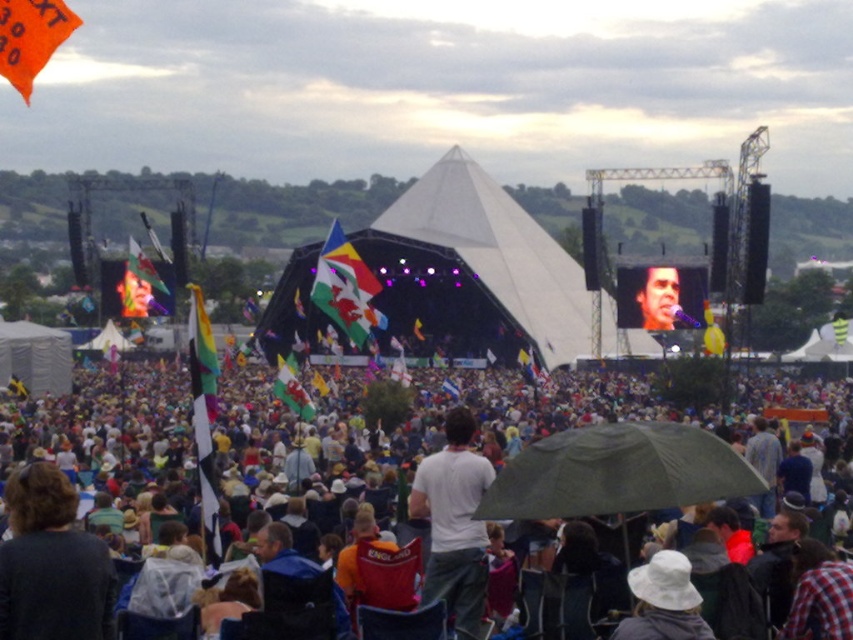
Who is more forward, (128, 378) or (646, 324)?

Point (646, 324) is more forward.

Between white fabric crowd at center and smooth skin face at center, which one has less height?

Standing shorter between the two is smooth skin face at center.

Which is in front, point (535, 522) or point (646, 273)?

Point (535, 522)

Identify the location of white fabric crowd at center. This screenshot has width=853, height=640. (108, 426).

Between dark gray sweater at lower left and white cotton shirt at center, which one appears on the left side from the viewer's perspective?

From the viewer's perspective, dark gray sweater at lower left appears more on the left side.

Between point (61, 621) and point (457, 592), which one is positioned in front?

Point (61, 621)

Locate an element on the screen. dark gray sweater at lower left is located at coordinates (51, 563).

This screenshot has width=853, height=640. What do you see at coordinates (618, 472) in the screenshot?
I see `green matte umbrella at center` at bounding box center [618, 472].

Which is behind, point (526, 464) or point (4, 573)?

Point (526, 464)

Identify the location of green matte umbrella at center. This screenshot has height=640, width=853. (618, 472).